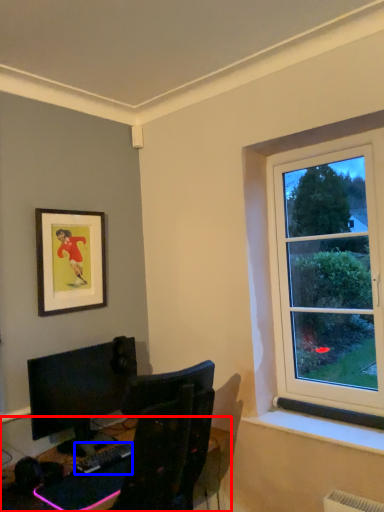
Question: Which point is closer to the camera, desk (highlighted by a red box) or computer keyboard (highlighted by a blue box)?

Choices:
 (A) desk
 (B) computer keyboard

Answer: (A)